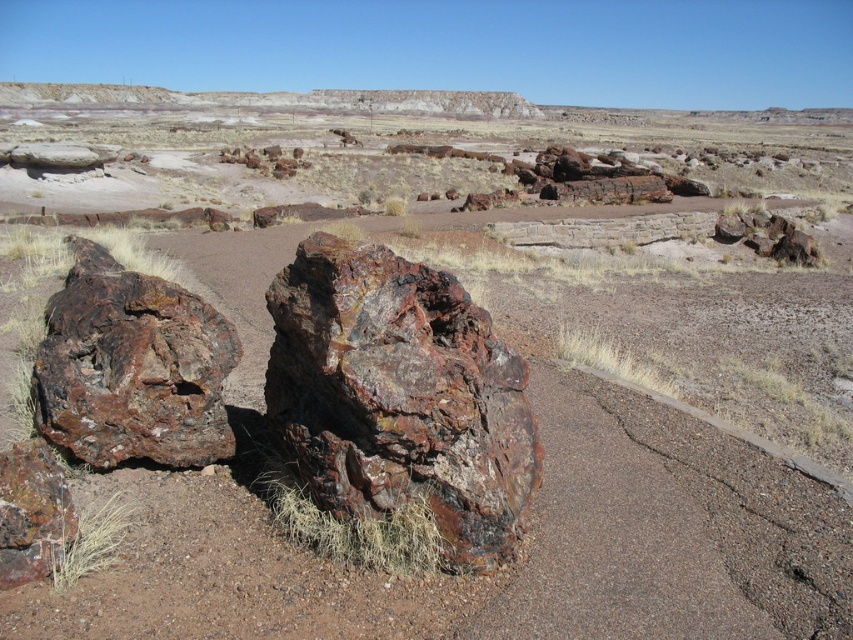
You are standing at point A and want to reach point B in the desert scene. The two points are marked as point A at (292, 275) and point B at 0.654, 0.212. According to the given coordinates, how far apart are these two points in feet?

The two points are 14.38 feet apart.

You are a geologist examining the petrified wood formations. You notice the rusty stone boulder at center and the rusty wood log at left. Which of these two objects has a smaller width?

The rusty stone boulder at center is thinner than the rusty wood log at left, so the rusty stone boulder at center has a smaller width.

You are standing in the desert and see the rusty stone boulder at center and the rusty wood log at left. Which object is nearer to you?

The rusty stone boulder at center is closer to the viewer than the rusty wood log at left.